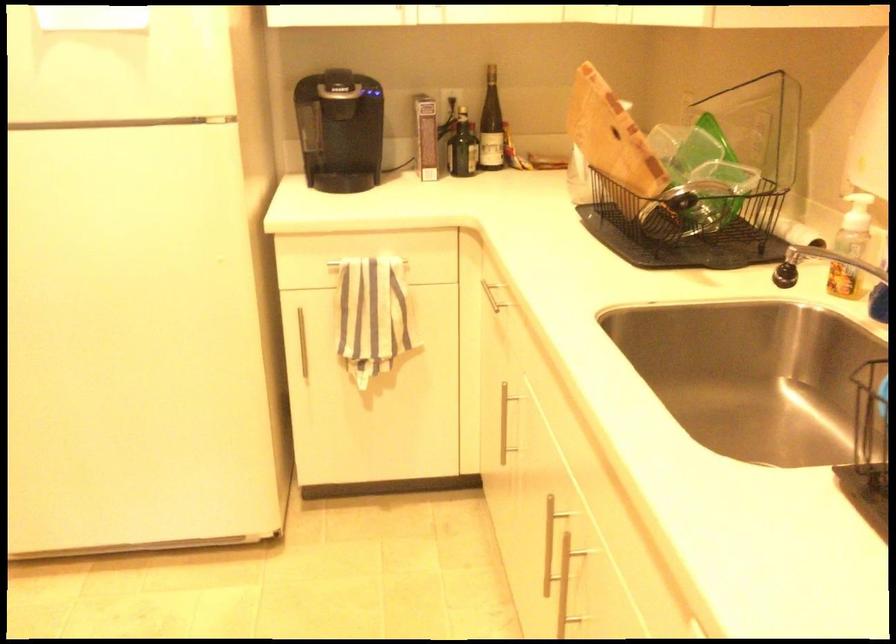
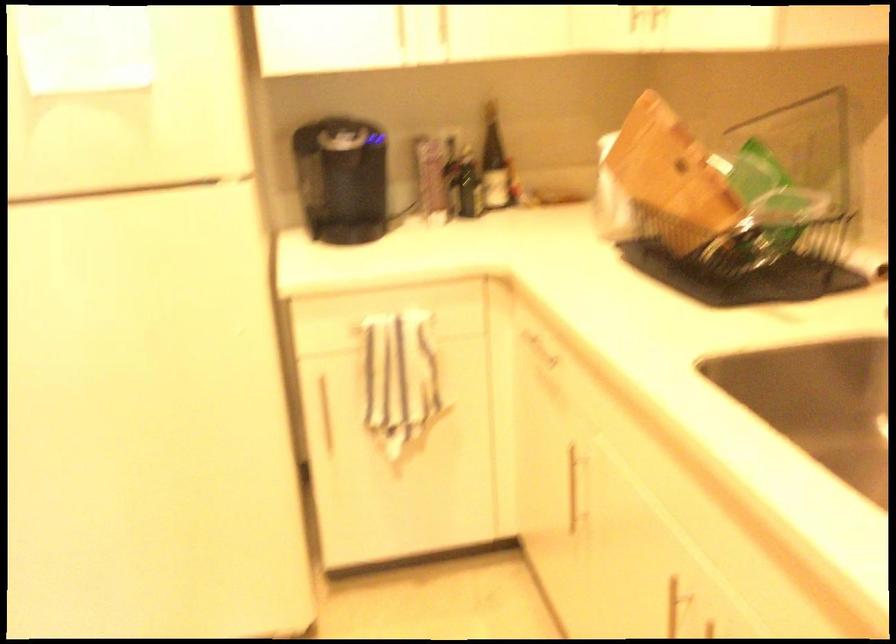
Question: The first image is from the beginning of the video and the second image is from the end. How did the camera likely rotate when shooting the video?

Choices:
 (A) Left
 (B) Right
 (C) Up
 (D) Down

Answer: (B)